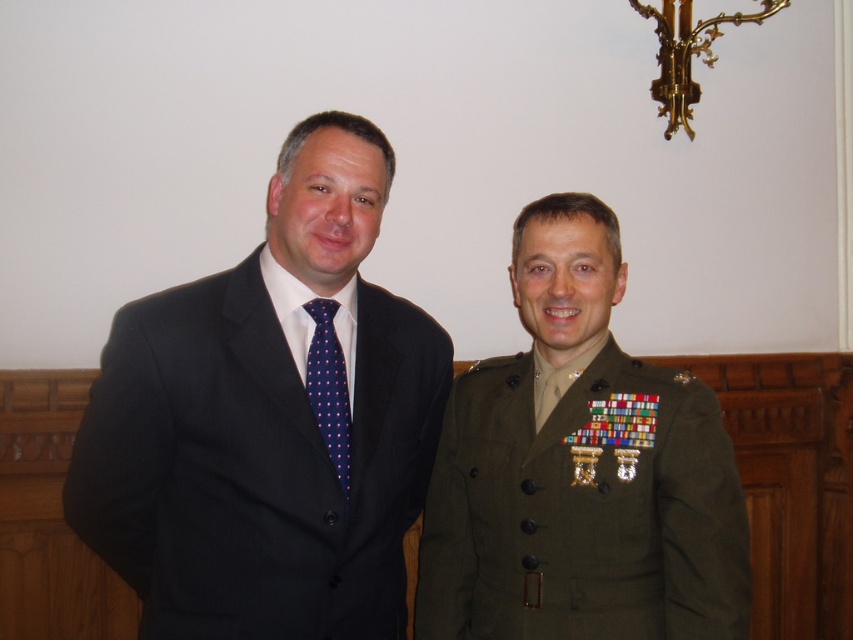
Question: Can you confirm if matte black suit at left is positioned to the left of green military uniform at right?

Choices:
 (A) no
 (B) yes

Answer: (B)

Question: Which point is farther from the camera taking this photo?

Choices:
 (A) (318, 397)
 (B) (692, 596)
 (C) (273, 220)

Answer: (B)

Question: Considering the real-world distances, which object is closest to the dark blue dotted tie at center?

Choices:
 (A) matte black suit at left
 (B) green military uniform at right

Answer: (A)

Question: Is matte black suit at left closer to the viewer compared to green military uniform at right?

Choices:
 (A) no
 (B) yes

Answer: (B)

Question: Is the position of matte black suit at left less distant than that of green military uniform at right?

Choices:
 (A) yes
 (B) no

Answer: (A)

Question: Among these objects, which one is farthest from the camera?

Choices:
 (A) green military uniform at right
 (B) matte black suit at left

Answer: (A)